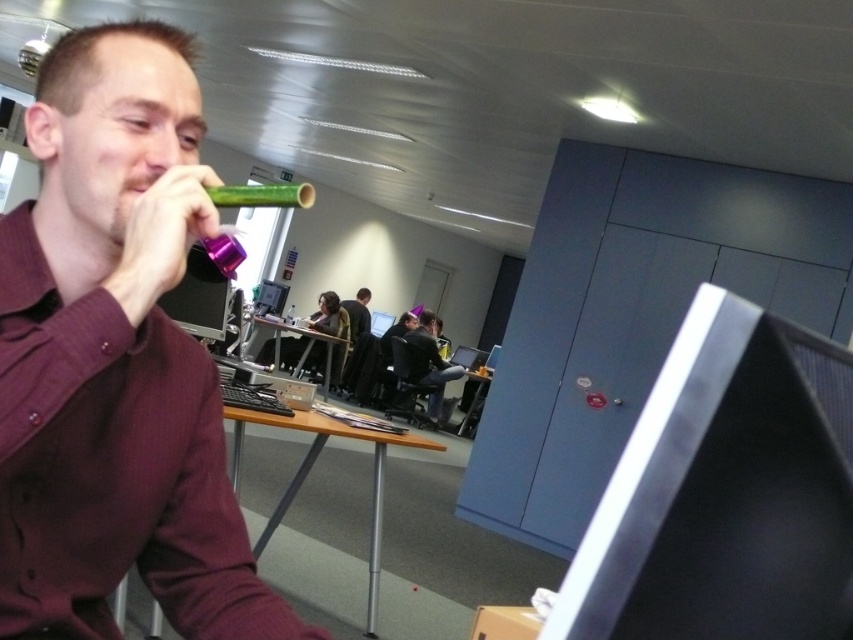
Can you confirm if dark gray sweater at center is positioned below wooden table at center?

Yes, dark gray sweater at center is below wooden table at center.

Is dark gray sweater at center to the right of wooden table at center from the viewer's perspective?

Indeed, dark gray sweater at center is positioned on the right side of wooden table at center.

Find the location of a particular element. This screenshot has width=853, height=640. dark gray sweater at center is located at coordinates (430, 365).

I want to click on dark gray sweater at center, so click(430, 365).

Can you confirm if matte black monitor at right is positioned to the left of matte black shirt at center?

Incorrect, matte black monitor at right is not on the left side of matte black shirt at center.

Does matte black monitor at right appear over matte black shirt at center?

Actually, matte black monitor at right is below matte black shirt at center.

Does point (643, 410) come in front of point (366, 320)?

Yes, it is.

Where is `matte black monitor at right`? The height and width of the screenshot is (640, 853). matte black monitor at right is located at coordinates (724, 492).

Who is more distant from viewer, (x=381, y=506) or (x=440, y=365)?

Point (x=440, y=365)

Does wooden desk at center have a smaller size compared to dark gray sweater at center?

No, wooden desk at center is not smaller than dark gray sweater at center.

I want to click on wooden desk at center, so click(310, 468).